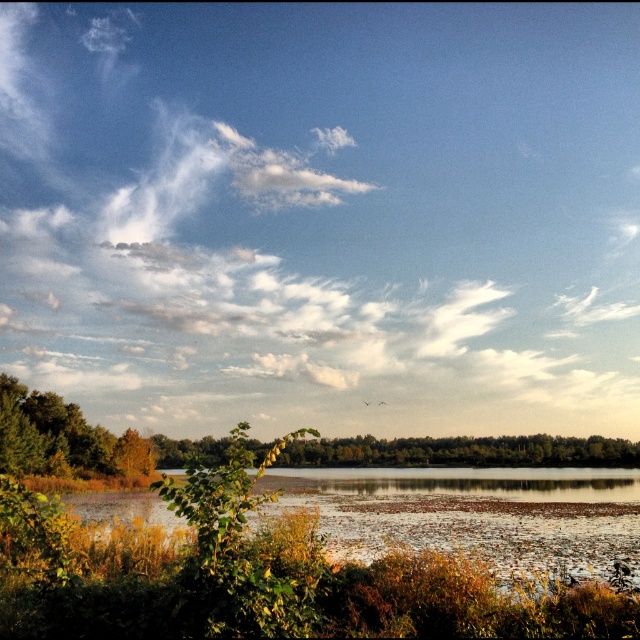
Question: Which point appears closest to the camera in this image?

Choices:
 (A) (380, 243)
 (B) (472, 520)
 (C) (49, 445)
 (D) (404, 440)

Answer: (B)

Question: Which of the following is the closest to the observer?

Choices:
 (A) green matte tree at lower left
 (B) white fluffy cloud at upper center
 (C) translucent water at center
 (D) green leafy tree at center

Answer: (C)

Question: Based on their relative distances, which object is nearer to the translucent water at center?

Choices:
 (A) green matte tree at lower left
 (B) green leafy tree at center

Answer: (A)

Question: Observing the image, what is the correct spatial positioning of translucent water at center in reference to green leafy tree at center?

Choices:
 (A) above
 (B) below

Answer: (A)

Question: Is white fluffy cloud at upper center smaller than translucent water at center?

Choices:
 (A) yes
 (B) no

Answer: (B)

Question: Is white fluffy cloud at upper center bigger than translucent water at center?

Choices:
 (A) yes
 (B) no

Answer: (A)